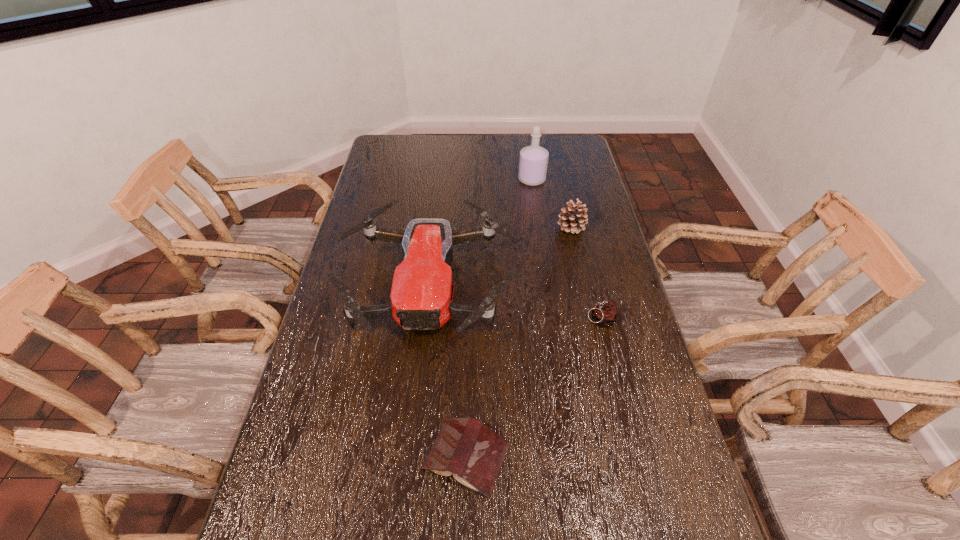
Find the location of a particular element. The height and width of the screenshot is (540, 960). blank space that satisfies the following two spatial constraints: 1. on the back side of the perfume; 2. on the right side of the shortest object is located at coordinates (472, 180).

Where is `vacant space that satisfies the following two spatial constraints: 1. on the front-facing side of the second tallest object; 2. on the right side of the nearest object`? This screenshot has width=960, height=540. vacant space that satisfies the following two spatial constraints: 1. on the front-facing side of the second tallest object; 2. on the right side of the nearest object is located at coordinates (409, 456).

Where is `free location that satisfies the following two spatial constraints: 1. on the back side of the taller pinecone; 2. on the right side of the book`? The height and width of the screenshot is (540, 960). free location that satisfies the following two spatial constraints: 1. on the back side of the taller pinecone; 2. on the right side of the book is located at coordinates (471, 227).